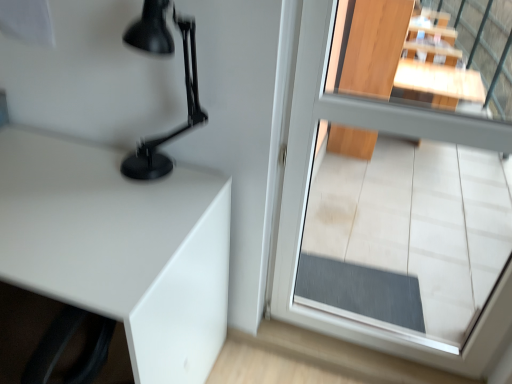
Identify the location of vacant space underneath matte black lamp at upper left (from a real-world perspective). (167, 182).